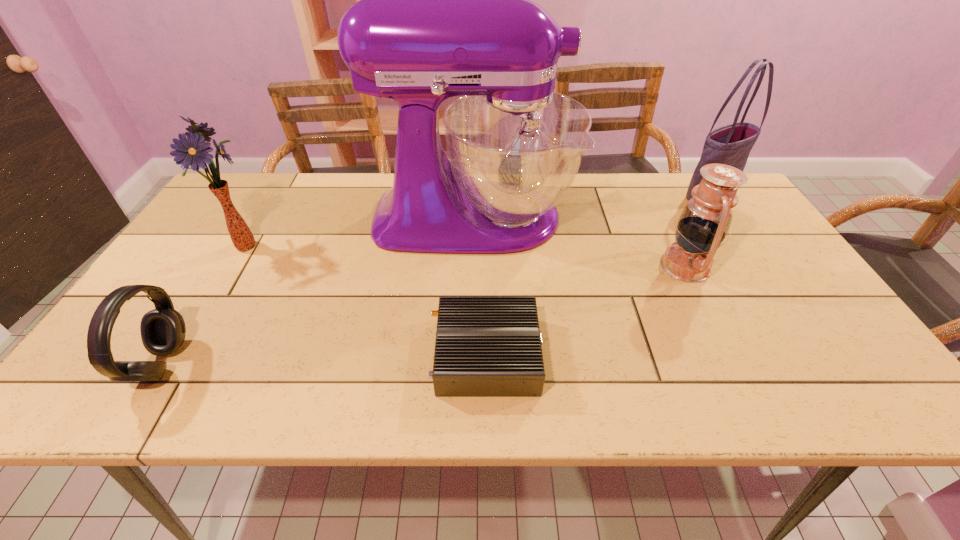
Locate an element on the screen. This screenshot has width=960, height=540. free space that satisfies the following two spatial constraints: 1. at the bowl opening of the fifth object from left to right; 2. on the left side of the tallest object is located at coordinates (472, 266).

The height and width of the screenshot is (540, 960). I want to click on blank area in the image that satisfies the following two spatial constraints: 1. at the bowl opening of the tallest object; 2. on the front side of the flower arrangement, so [x=473, y=245].

Locate an element on the screen. Image resolution: width=960 pixels, height=540 pixels. vacant region that satisfies the following two spatial constraints: 1. at the bowl opening of the third shortest object; 2. on the left side of the tallest object is located at coordinates (472, 266).